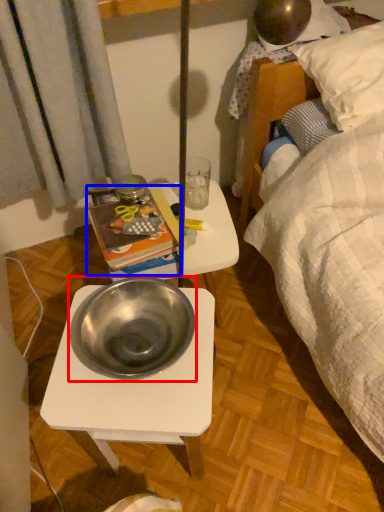
Question: Which of the following is the closest to the observer, bowl (highlighted by a red box) or paperback book (highlighted by a blue box)?

Choices:
 (A) bowl
 (B) paperback book

Answer: (A)